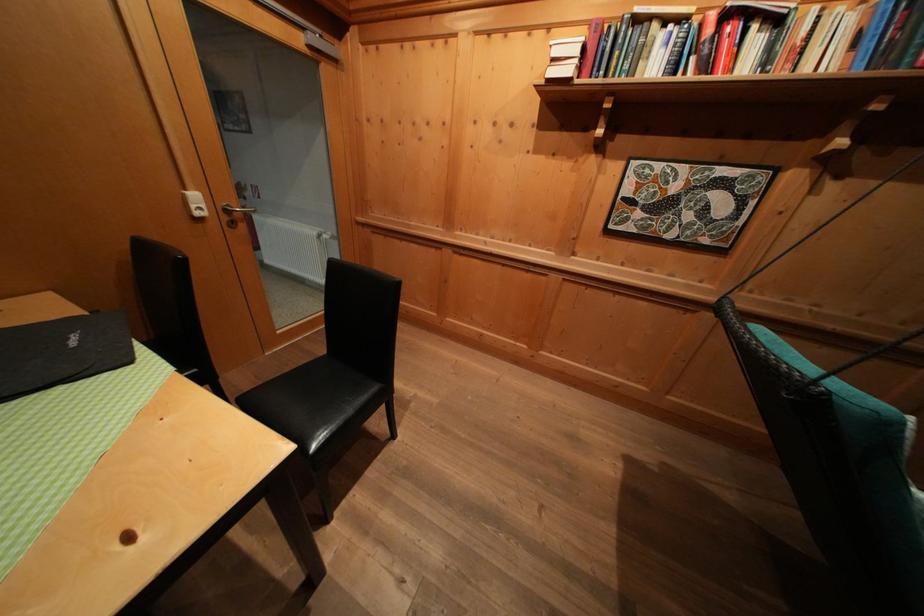
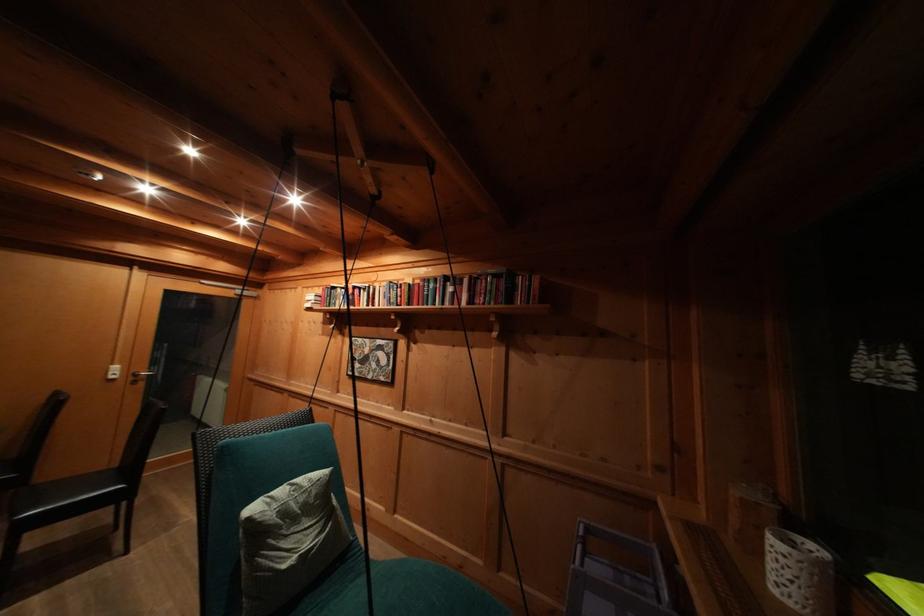
The point at (495,38) is marked in the first image. Where is the corresponding point in the second image?

(313, 293)